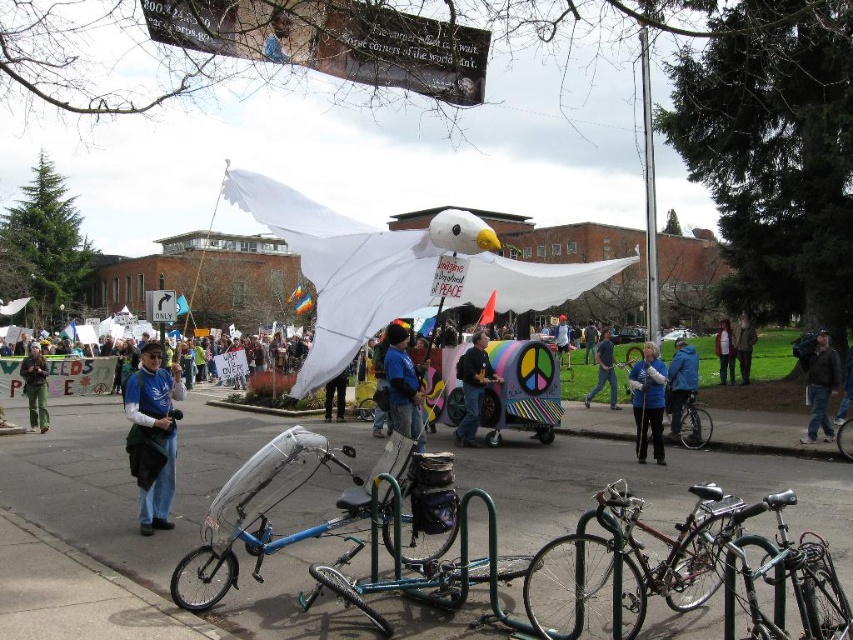
Question: Among these points, which one is farthest from the camera?

Choices:
 (A) (596, 360)
 (B) (138, 470)
 (C) (631, 636)

Answer: (A)

Question: Is blue fleece jacket at center below green corduroy pants at lower left?

Choices:
 (A) yes
 (B) no

Answer: (A)

Question: Which of these objects is positioned closest to the blue jacket at center?

Choices:
 (A) denim jacket at center
 (B) blue fabric at center
 (C) transparent plastic bicycle at center
 (D) shiny black bicycle at lower right

Answer: (B)

Question: Does blue fabric jacket at center appear over denim jacket at center?

Choices:
 (A) yes
 (B) no

Answer: (B)

Question: Among these points, which one is farthest from the camera?

Choices:
 (A) (828, 348)
 (B) (672, 428)
 (C) (560, 326)
 (D) (370, 419)

Answer: (C)

Question: Is blue fabric shirt at center further to the viewer compared to shiny silver bicycle at lower right?

Choices:
 (A) yes
 (B) no

Answer: (B)